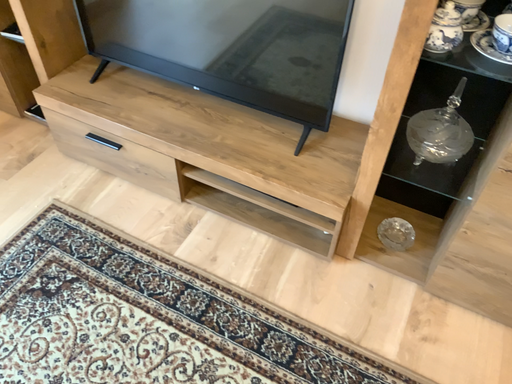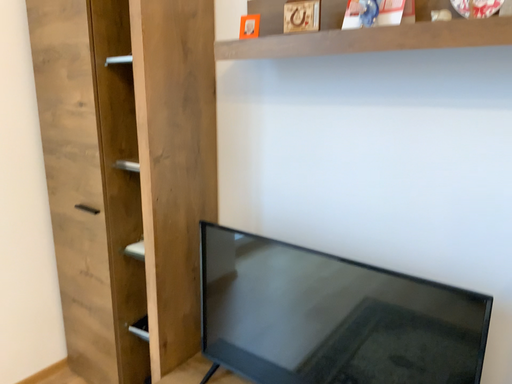
Question: Which way did the camera rotate in the video?

Choices:
 (A) rotated downward
 (B) rotated upward

Answer: (B)